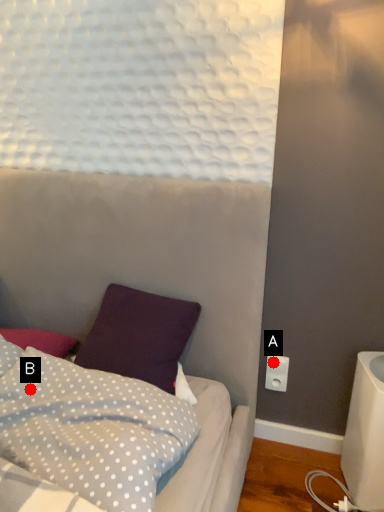
Question: Two points are circled on the image, labeled by A and B beside each circle. Which point is closer to the camera?

Choices:
 (A) A is closer
 (B) B is closer

Answer: (B)